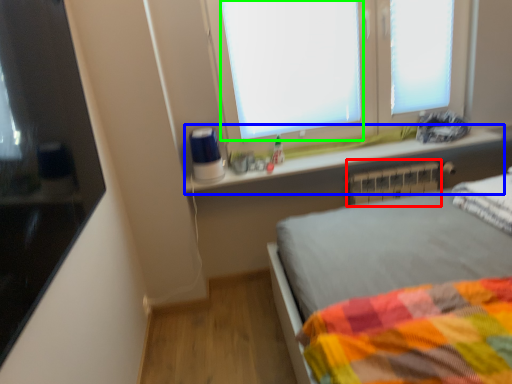
Question: Based on their relative distances, which object is farther from radiator (highlighted by a red box)? Choose from window sill (highlighted by a blue box) and window screen (highlighted by a green box).

Choices:
 (A) window sill
 (B) window screen

Answer: (B)